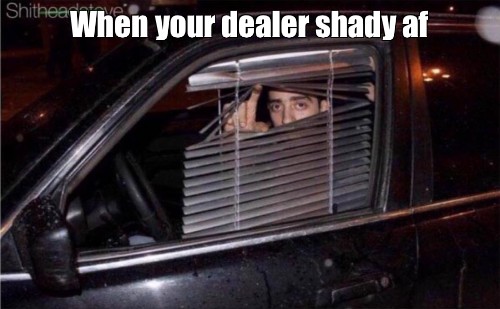
Find the location of `door handle`. door handle is located at coordinates (353, 292).